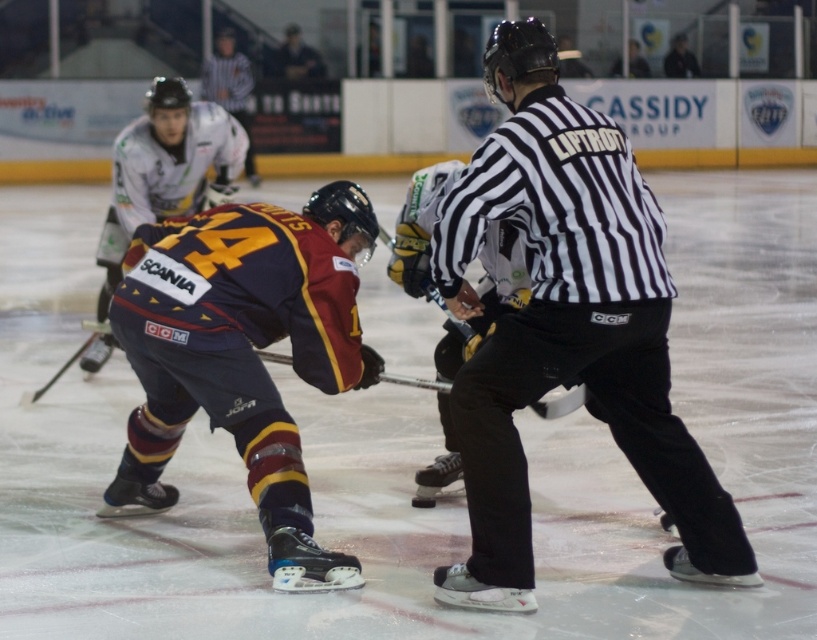
Does black striped shirt at center appear over maroon jersey at center?

No, black striped shirt at center is not above maroon jersey at center.

Can you confirm if black striped shirt at center is positioned below maroon jersey at center?

Yes, black striped shirt at center is below maroon jersey at center.

Between point (578, 106) and point (226, 138), which one is positioned in front?

Point (578, 106) is more forward.

At what (x,y) coordinates should I click in order to perform the action: click on black striped shirt at center. Please return your answer as a coordinate pair (x, y). Looking at the image, I should click on pyautogui.click(x=567, y=326).

What do you see at coordinates (567, 326) in the screenshot?
I see `black striped shirt at center` at bounding box center [567, 326].

Is black striped shirt at center taller than black rubber hockey stick at center?

Yes, black striped shirt at center is taller than black rubber hockey stick at center.

Who is more forward, (595,124) or (565,390)?

Point (595,124) is in front.

Where is `black striped shirt at center`? Image resolution: width=817 pixels, height=640 pixels. black striped shirt at center is located at coordinates (567, 326).

Can you confirm if maroon jersey at center is positioned above black rubber hockey stick at center?

Correct, maroon jersey at center is located above black rubber hockey stick at center.

Who is more forward, [106,275] or [435,298]?

Point [435,298]

What are the coordinates of `maroon jersey at center` in the screenshot? It's located at (166, 168).

Find the location of a particular element. maroon jersey at center is located at coordinates (166, 168).